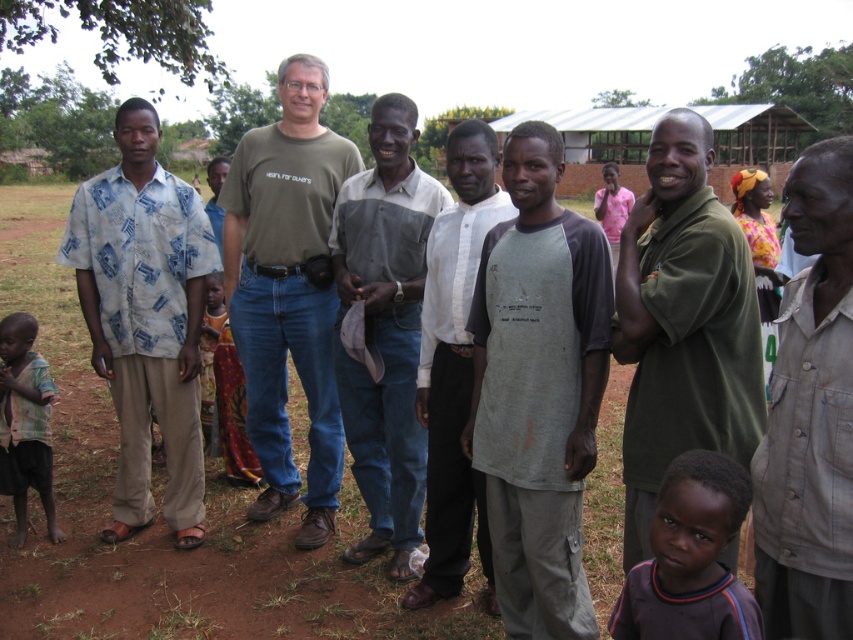
You are a photographer trying to capture a clear shot of both the gray cotton shirt at center and the printed fabric dress at center. Since you want both subjects to be in focus, which one should you adjust your camera focus to prioritize first?

The gray cotton shirt at center is closer to the viewer than the printed fabric dress at center. To ensure both are in focus, prioritize focusing on the gray cotton shirt at center first, as it is closer, and the depth of field may naturally include the printed fabric dress at center in the background.

You are standing at the point with coordinates (288, 291) in the image. What object is located exactly at that point?

The point at coordinates (288, 291) corresponds to the matte green tshirt at center.